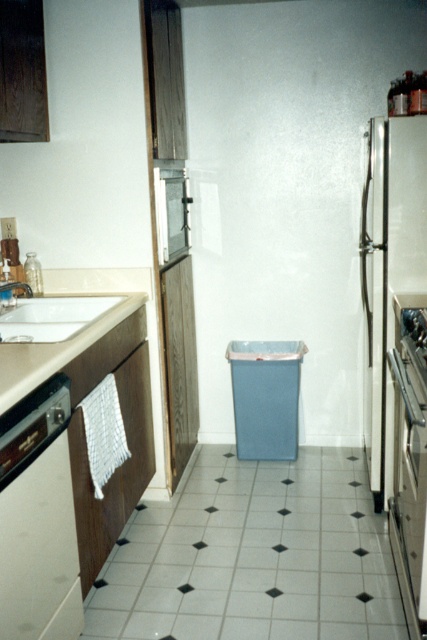
Can you confirm if white tile at center is thinner than satin silver oven at right?

No.

Is point (114, 547) less distant than point (389, 525)?

Yes.

Where is `white tile at center`? The width and height of the screenshot is (427, 640). white tile at center is located at coordinates (253, 556).

Does white tile at center have a lesser width compared to white laminate counter at left?

No, white tile at center is not thinner than white laminate counter at left.

I want to click on white tile at center, so click(x=253, y=556).

Between point (143, 536) and point (47, 301), which one is positioned behind?

Point (47, 301)

I want to click on white tile at center, so click(253, 556).

Does satin silver refrigerator at right have a greater width compared to white laminate counter at left?

Incorrect, satin silver refrigerator at right's width does not surpass white laminate counter at left's.

Does satin silver refrigerator at right appear on the right side of white laminate counter at left?

Indeed, satin silver refrigerator at right is positioned on the right side of white laminate counter at left.

The image size is (427, 640). Find the location of `satin silver refrigerator at right`. satin silver refrigerator at right is located at coordinates (388, 272).

Find the location of a particular element. This screenshot has width=427, height=640. satin silver refrigerator at right is located at coordinates (388, 272).